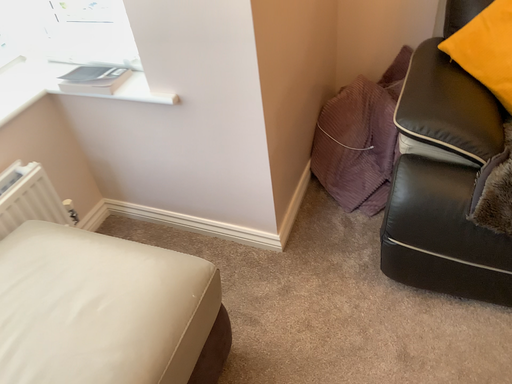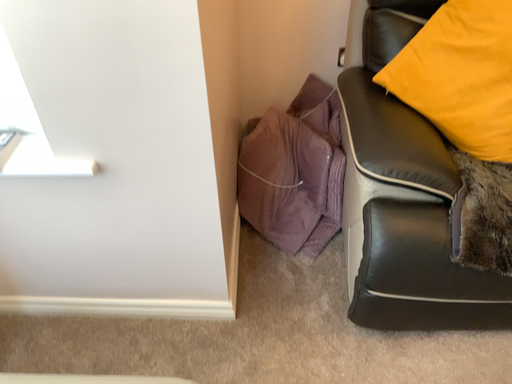
Question: How did the camera likely rotate when shooting the video?

Choices:
 (A) rotated left
 (B) rotated right

Answer: (B)